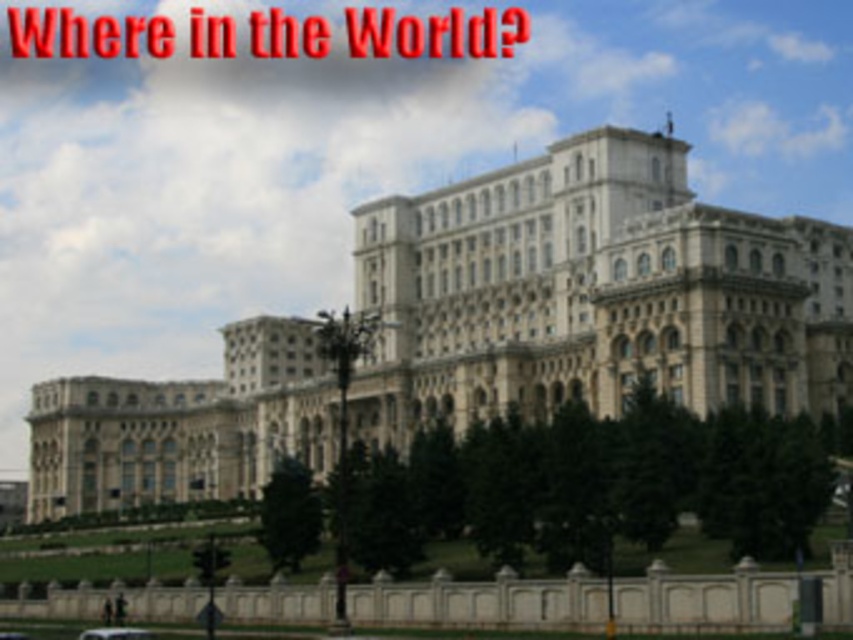
Question: Is beige stone building at center below metallic silver car at lower center?

Choices:
 (A) no
 (B) yes

Answer: (A)

Question: Among these objects, which one is farthest from the camera?

Choices:
 (A) beige stone building at center
 (B) white matte car at lower left

Answer: (A)

Question: Among these objects, which one is farthest from the camera?

Choices:
 (A) white matte car at lower left
 (B) beige stone building at center
 (C) metallic silver car at lower center

Answer: (B)

Question: Is beige stone building at center to the right of white matte car at lower left from the viewer's perspective?

Choices:
 (A) no
 (B) yes

Answer: (B)

Question: Can you confirm if beige stone building at center is bigger than metallic silver car at lower center?

Choices:
 (A) yes
 (B) no

Answer: (A)

Question: Which point is farther to the camera?

Choices:
 (A) beige stone building at center
 (B) metallic silver car at lower center
 (C) white matte car at lower left

Answer: (A)